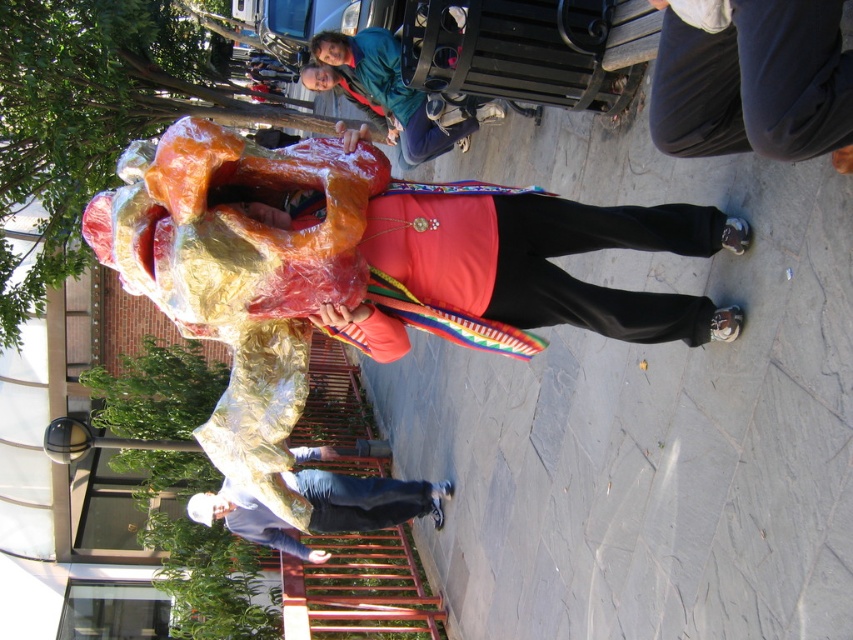
You are planning to create a replica of the shiny metallic costume at center and the shiny gold costume at center for a school play. Given the space constraints in the school auditorium, which costume would require more space to display properly?

The shiny gold costume at center requires more space to display properly because it occupies more space than the shiny metallic costume at center according to the description.

You are an event organizer planning to arrange the shiny metallic costume at center and the shiny gold costume at center in a narrow corridor. The corridor is only 1.2 meters wide. Can both costumes be placed side by side without overlapping?

The shiny metallic costume at center is narrower than the shiny gold costume at center. However, since the total width of both costumes combined would exceed the corridor width of 1.2 meters, they cannot be placed side by side without overlapping.

Based on the photo, you are a photographer at the festival and want to capture both the shiny metallic costume at center and the shiny gold costume at center in a single frame. Which costume should you focus on first to ensure both are in the frame?

The shiny metallic costume at center is shorter than the shiny gold costume at center. Focus on the shiny metallic costume at center first, as it is shorter and closer to the camera, ensuring both will fit in the frame.